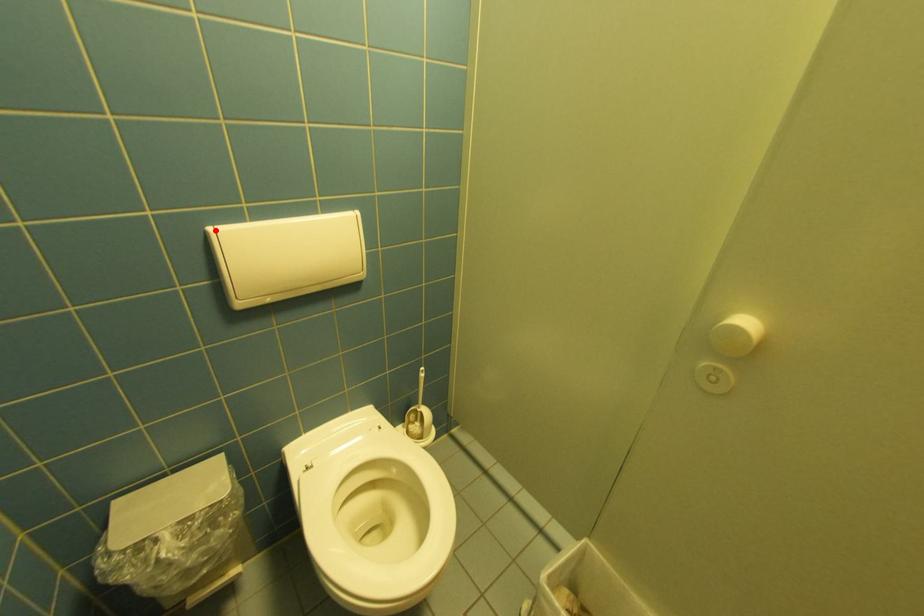
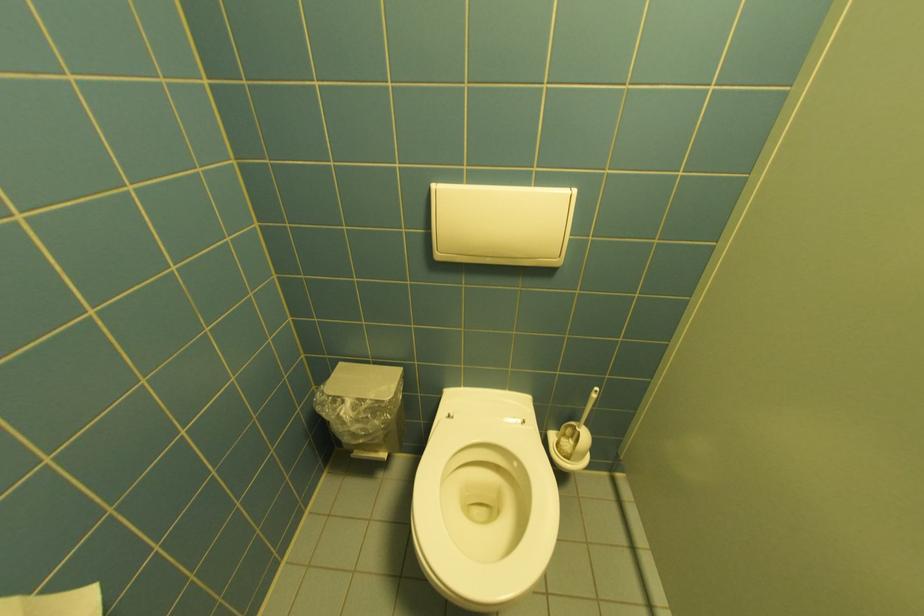
Locate, in the second image, the point that corresponds to the highlighted location in the first image.

(440, 185)